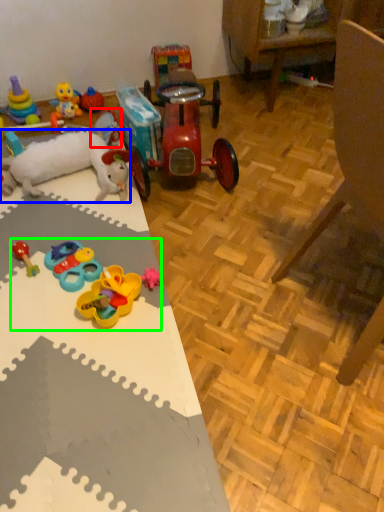
Question: Which object is positioned closest to toy (highlighted by a red box)? Select from toy (highlighted by a blue box) and toy (highlighted by a green box).

Choices:
 (A) toy
 (B) toy

Answer: (A)